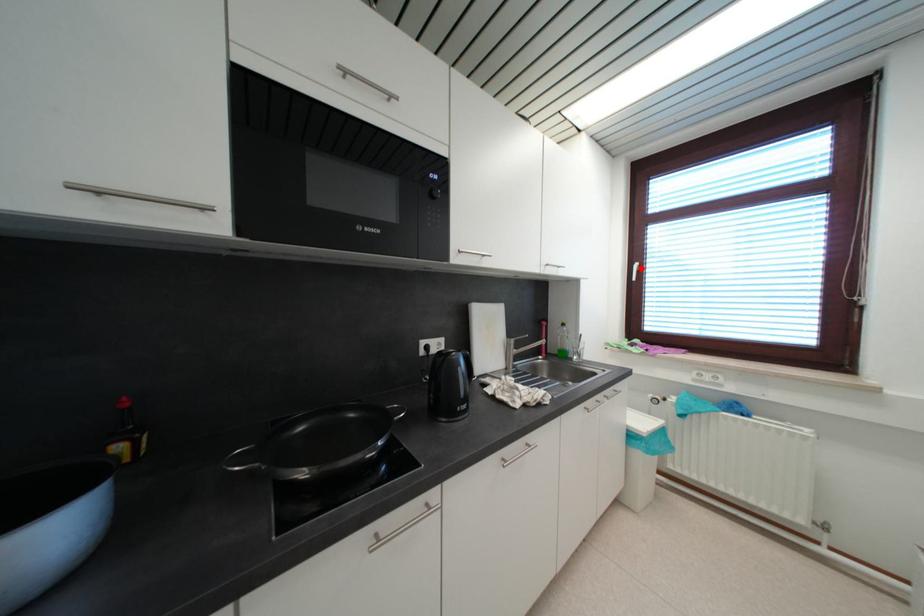
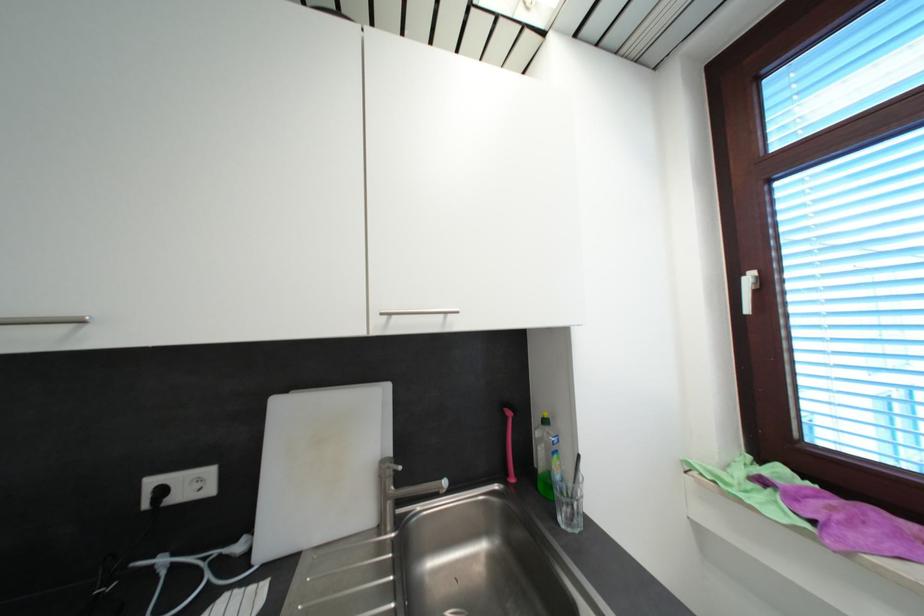
Question: I am providing you with two images of the same scene from different viewpoints. A red point is marked on the first image. At the location where the point appears in image 1, is it still visible in image 2?

Choices:
 (A) Yes
 (B) No

Answer: (A)